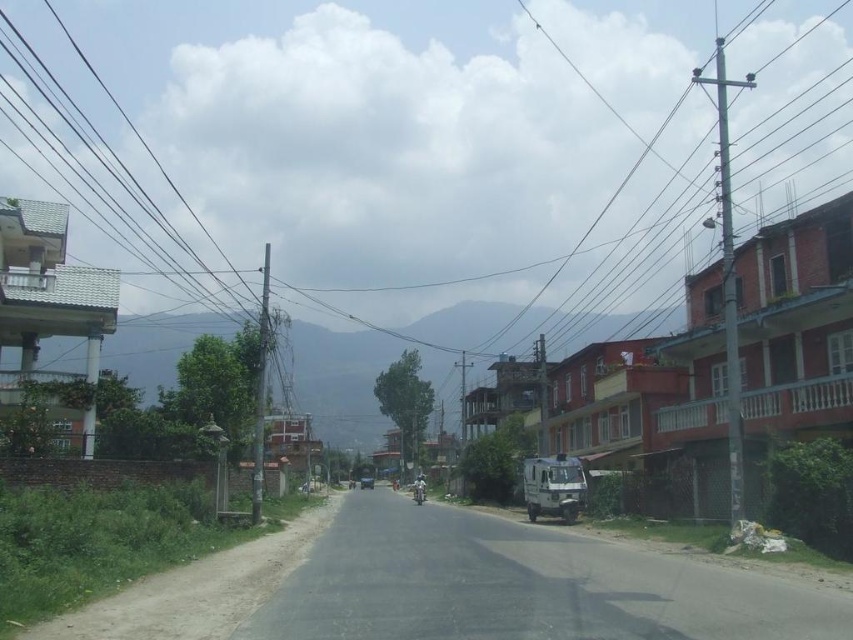
Who is positioned more to the left, shiny chrome motorcycle at center or metallic blue car at center?

From the viewer's perspective, metallic blue car at center appears more on the left side.

Is point (415, 493) behind point (367, 477)?

No, it is in front of (367, 477).

The width and height of the screenshot is (853, 640). Find the location of `shiny chrome motorcycle at center`. shiny chrome motorcycle at center is located at coordinates (418, 490).